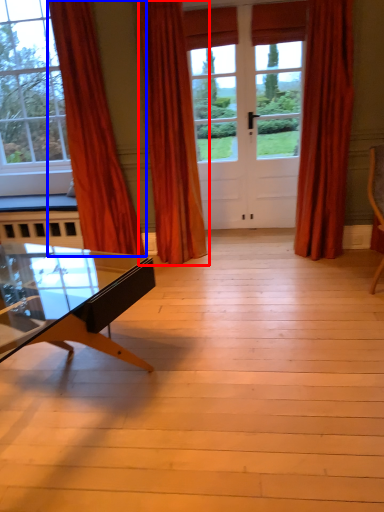
Question: Which object appears farthest to the camera in this image, curtain (highlighted by a red box) or curtain (highlighted by a blue box)?

Choices:
 (A) curtain
 (B) curtain

Answer: (A)